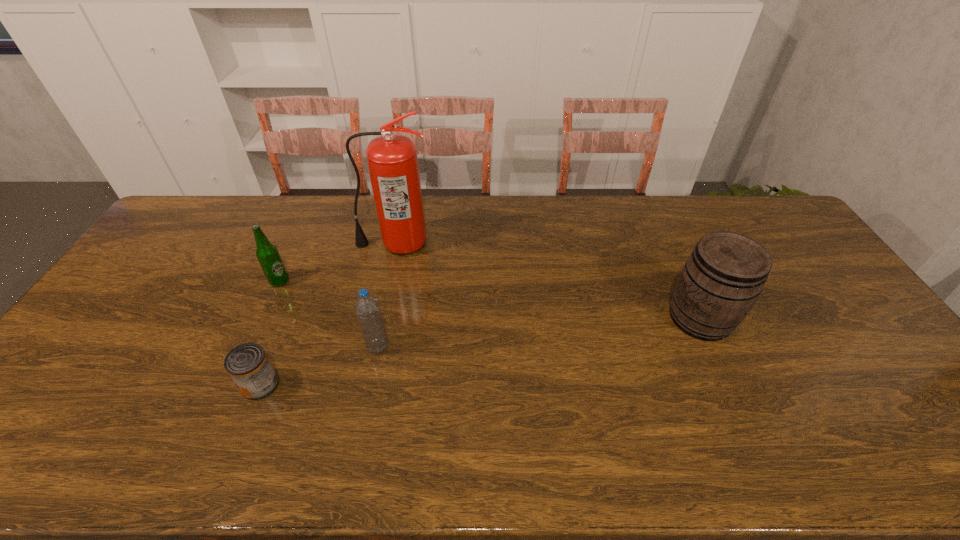
Where is `free space located 0.390m on the label of the second farthest object`? The image size is (960, 540). free space located 0.390m on the label of the second farthest object is located at coordinates (415, 281).

Where is `free space located 0.170m on the front of the shortest object`? This screenshot has width=960, height=540. free space located 0.170m on the front of the shortest object is located at coordinates (227, 471).

Find the location of `object at the far edge`. object at the far edge is located at coordinates (392, 160).

The height and width of the screenshot is (540, 960). In order to click on blank space at the far edge of the desktop in this screenshot , I will do `click(287, 222)`.

In the image, there is a desktop. What are the coordinates of `blank space at the near edge` in the screenshot? It's located at (895, 467).

In the image, there is a desktop. Where is `free space at the left edge`? The image size is (960, 540). free space at the left edge is located at coordinates tap(72, 382).

In the image, there is a desktop. At what (x,y) coordinates should I click in order to perform the action: click on vacant space at the right edge. Please return your answer as a coordinate pair (x, y). The image size is (960, 540). Looking at the image, I should click on (815, 267).

What are the coordinates of `free space between the second farthest object and the tallest object` in the screenshot? It's located at (337, 262).

Identify the location of vacant area between the tallest object and the fourth nearest object. Image resolution: width=960 pixels, height=540 pixels. point(337,262).

In order to click on empty location between the rightmost object and the beer bottle in this screenshot , I will do `click(490, 300)`.